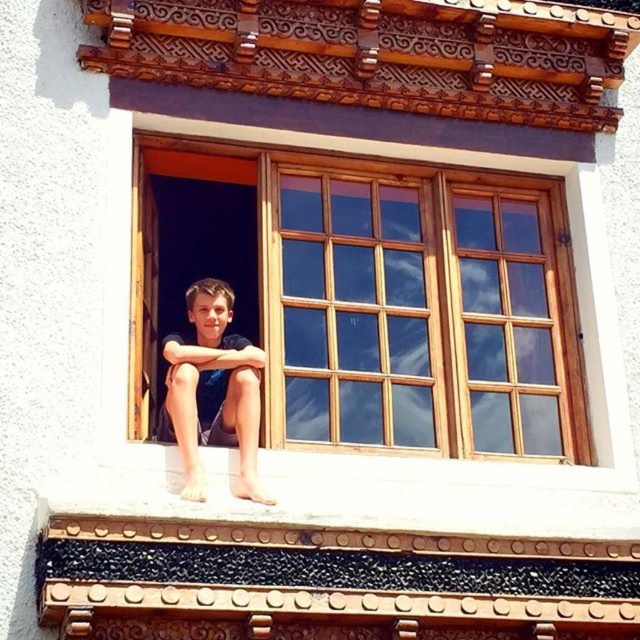
Between point (307, 388) and point (260, 355), which one is positioned in front?

Point (260, 355) is more forward.

Is wooden window at center above dark blue fabric shorts at center?

Yes.

Does point (257, 186) come farther from viewer compared to point (236, 365)?

Yes, it is.

Image resolution: width=640 pixels, height=640 pixels. Find the location of `wooden window at center`. wooden window at center is located at coordinates (388, 300).